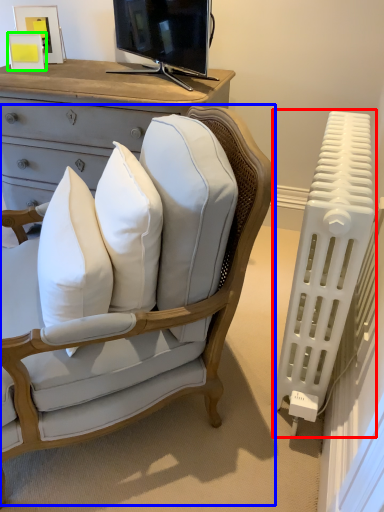
Question: Which object is positioned farthest from radiator (highlighted by a red box)? Select from chair (highlighted by a blue box) and picture frame (highlighted by a green box).

Choices:
 (A) chair
 (B) picture frame

Answer: (B)